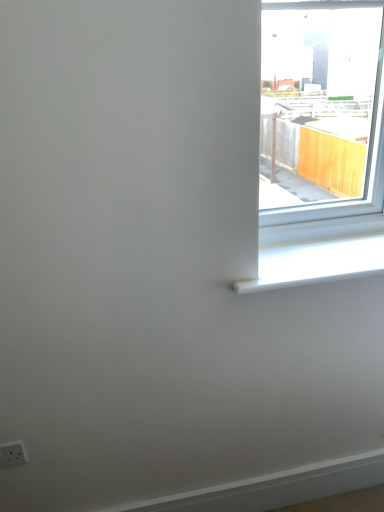
Question: From a real-world perspective, is white plastic window sill at upper right on top of white plastic electric outlet at lower left?

Choices:
 (A) yes
 (B) no

Answer: (A)

Question: Does white plastic window sill at upper right have a greater height compared to white plastic electric outlet at lower left?

Choices:
 (A) no
 (B) yes

Answer: (A)

Question: Is white plastic window sill at upper right bigger than white plastic electric outlet at lower left?

Choices:
 (A) no
 (B) yes

Answer: (B)

Question: Considering the relative sizes of white plastic window sill at upper right and white plastic electric outlet at lower left in the image provided, is white plastic window sill at upper right thinner than white plastic electric outlet at lower left?

Choices:
 (A) no
 (B) yes

Answer: (A)

Question: From the image's perspective, does white plastic window sill at upper right appear higher than white plastic electric outlet at lower left?

Choices:
 (A) no
 (B) yes

Answer: (B)

Question: Is white plastic window sill at upper right in front of white plastic electric outlet at lower left?

Choices:
 (A) no
 (B) yes

Answer: (B)

Question: Can you confirm if white plastic electric outlet at lower left is taller than white plastic window sill at upper right?

Choices:
 (A) no
 (B) yes

Answer: (B)

Question: Is white plastic electric outlet at lower left closer to the viewer compared to white plastic window sill at upper right?

Choices:
 (A) yes
 (B) no

Answer: (B)

Question: Considering the relative positions of white plastic electric outlet at lower left and white plastic window sill at upper right in the image provided, is white plastic electric outlet at lower left to the left of white plastic window sill at upper right from the viewer's perspective?

Choices:
 (A) no
 (B) yes

Answer: (B)

Question: Is white plastic electric outlet at lower left behind white plastic window sill at upper right?

Choices:
 (A) yes
 (B) no

Answer: (A)

Question: Is white plastic electric outlet at lower left aimed at white plastic window sill at upper right?

Choices:
 (A) no
 (B) yes

Answer: (A)

Question: Are white plastic electric outlet at lower left and white plastic window sill at upper right far apart?

Choices:
 (A) yes
 (B) no

Answer: (B)

Question: In terms of width, does white plastic electric outlet at lower left look wider or thinner when compared to white plastic window sill at upper right?

Choices:
 (A) wide
 (B) thin

Answer: (B)